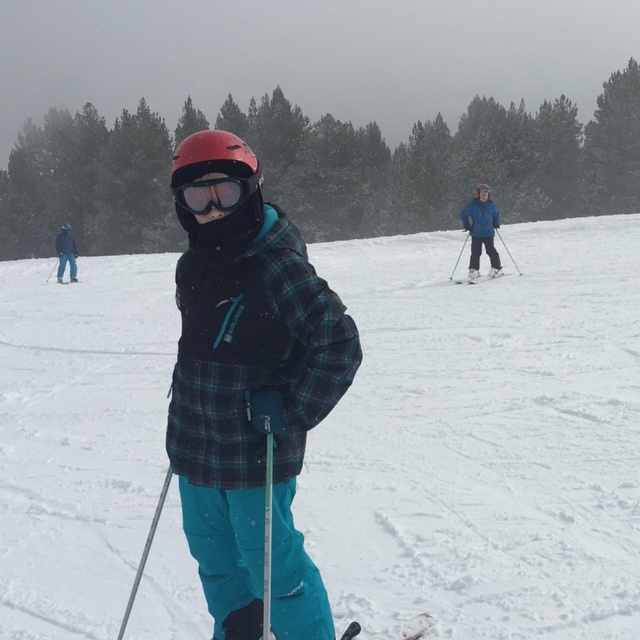
Between white matte snow at center and blue fabric jacket at left, which one has more height?

blue fabric jacket at left is taller.

Is white matte snow at center closer to camera compared to blue fabric jacket at left?

Yes.

In order to click on white matte snow at center in this screenshot , I will do `click(483, 438)`.

Where is `white matte snow at center`? The image size is (640, 640). white matte snow at center is located at coordinates (483, 438).

Is point (486, 196) more distant than point (67, 250)?

No, (486, 196) is closer to viewer.

Where is `blue matte jacket at center`? The height and width of the screenshot is (640, 640). blue matte jacket at center is located at coordinates (481, 230).

Measure the distance between point (472, 268) and camera.

Point (472, 268) is 19.14 meters from camera.

Where is `blue matte jacket at center`? Image resolution: width=640 pixels, height=640 pixels. blue matte jacket at center is located at coordinates (481, 230).

Can you confirm if plaid jacket at center is positioned below matte black ski at left?

Correct, plaid jacket at center is located below matte black ski at left.

Between plaid jacket at center and matte black ski at left, which one appears on the right side from the viewer's perspective?

plaid jacket at center is more to the right.

Which is behind, point (244, 408) or point (61, 280)?

Point (61, 280)

At what (x,y) coordinates should I click in order to perform the action: click on plaid jacket at center. Please return your answer as a coordinate pair (x, y). Looking at the image, I should click on (252, 410).